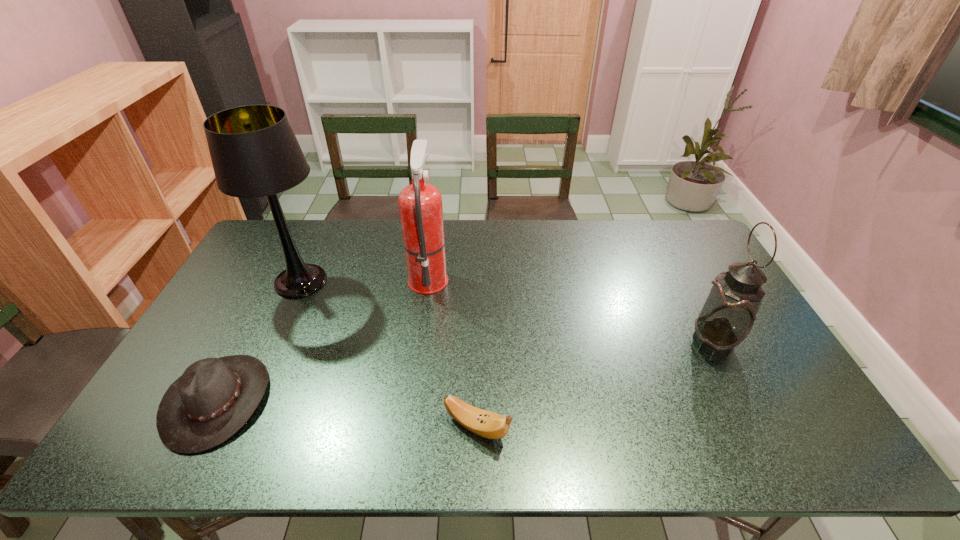
The width and height of the screenshot is (960, 540). I want to click on vacant space at the near edge of the desktop, so click(440, 436).

Find the location of a particular element. The height and width of the screenshot is (540, 960). free location at the left edge is located at coordinates (210, 340).

Where is `free space at the far left corner of the desktop`? This screenshot has height=540, width=960. free space at the far left corner of the desktop is located at coordinates (300, 224).

In the image, there is a desktop. At what (x,y) coordinates should I click in order to perform the action: click on vacant space at the near left corner. Please return your answer as a coordinate pair (x, y). The image size is (960, 540). Looking at the image, I should click on (165, 447).

Locate an element on the screen. vacant space at the far right corner of the desktop is located at coordinates (664, 255).

Where is `free space between the fourth object from left to right and the fire extinguisher`? The image size is (960, 540). free space between the fourth object from left to right and the fire extinguisher is located at coordinates (452, 352).

Find the location of a particular element. vacant space that is in between the third object from left to right and the rightmost object is located at coordinates (571, 309).

Locate an element on the screen. This screenshot has height=540, width=960. empty space that is in between the oil lamp and the hat is located at coordinates (466, 371).

Find the location of a particular element. free space between the hat and the third object from left to right is located at coordinates (323, 339).

Find the location of `free point between the table lamp and the third object from right to left`. free point between the table lamp and the third object from right to left is located at coordinates pos(365,279).